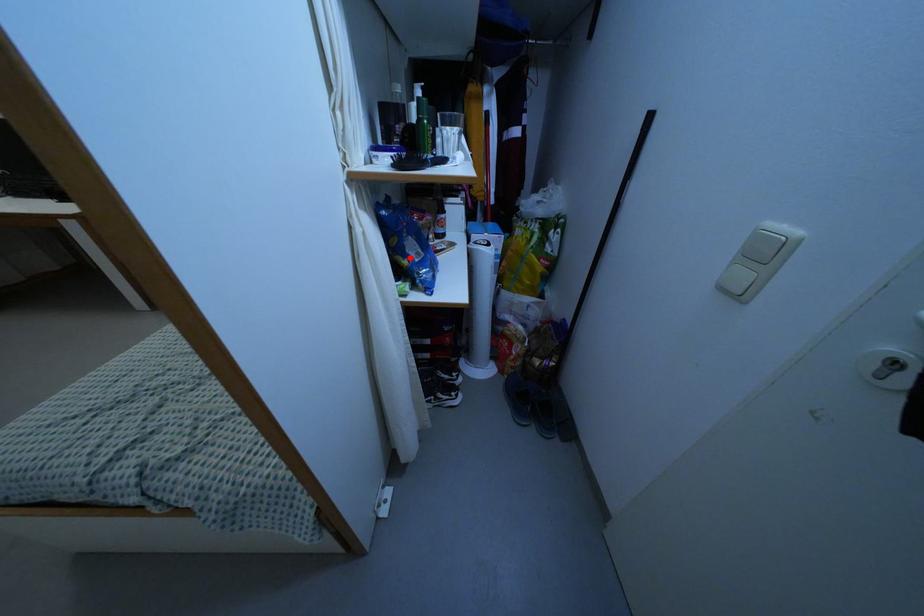
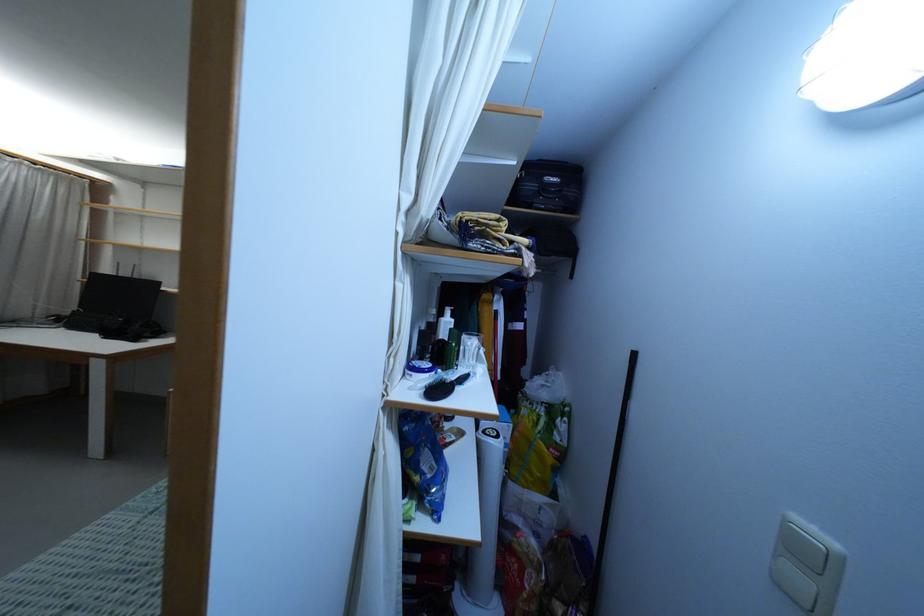
Question: I am providing you with two images of the same scene from different viewpoints. A red point is marked on the first image. Is the red point's position out of view in image 2?

Choices:
 (A) Yes
 (B) No

Answer: (B)